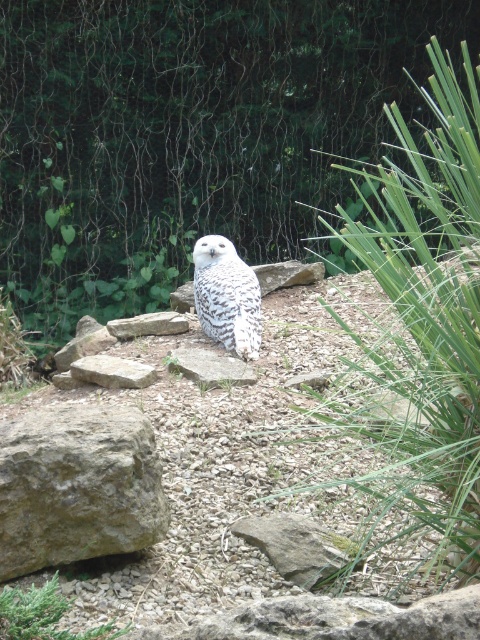
Question: Which point is farther to the camera?

Choices:
 (A) brown rough rock at lower left
 (B) gray rock at center
 (C) white speckled owl at center

Answer: (B)

Question: Can you confirm if gray rough rock at center is positioned below gray rough stone at center?

Choices:
 (A) yes
 (B) no

Answer: (A)

Question: Is brown rough rock at lower left smaller than gray rough rock at center?

Choices:
 (A) yes
 (B) no

Answer: (B)

Question: Estimate the real-world distances between objects in this image. Which object is closer to the white speckled owl at center?

Choices:
 (A) brown rough rock at lower left
 (B) gray rough rock at center

Answer: (B)

Question: Does gray rough stone at center appear over gray rock at center?

Choices:
 (A) yes
 (B) no

Answer: (B)

Question: Which point appears farthest from the camera in this image?

Choices:
 (A) (204, 282)
 (B) (101, 406)
 (C) (99, 376)

Answer: (A)